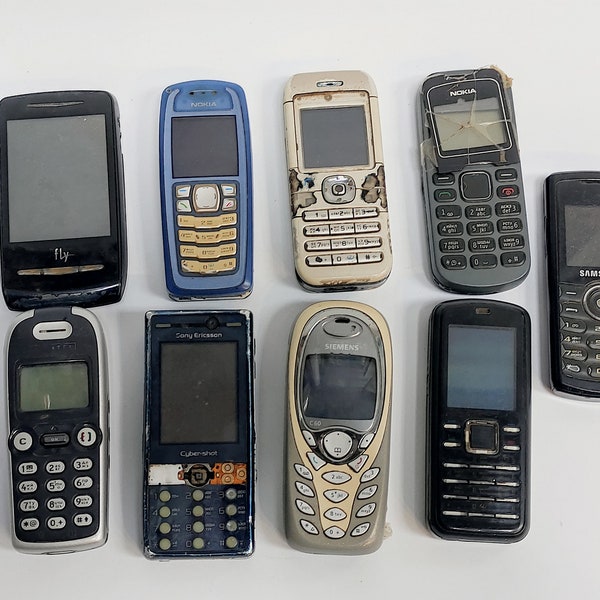
Where is `phone screen`? The image size is (600, 600). phone screen is located at coordinates (65, 395), (197, 391), (65, 177), (205, 141), (340, 135), (478, 132), (347, 383), (477, 370), (585, 240).